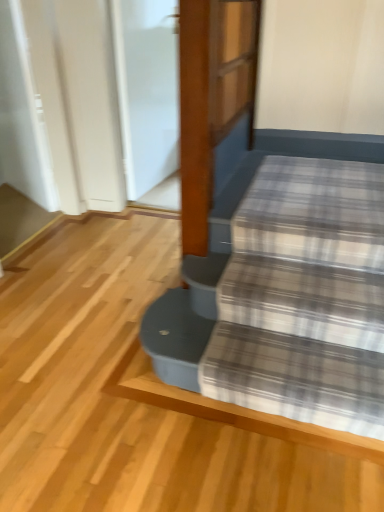
At what (x,y) coordinates should I click in order to perform the action: click on free point to the left of plaid fabric at lower right. Please return your answer as a coordinate pair (x, y). This screenshot has width=384, height=512. Looking at the image, I should click on (91, 386).